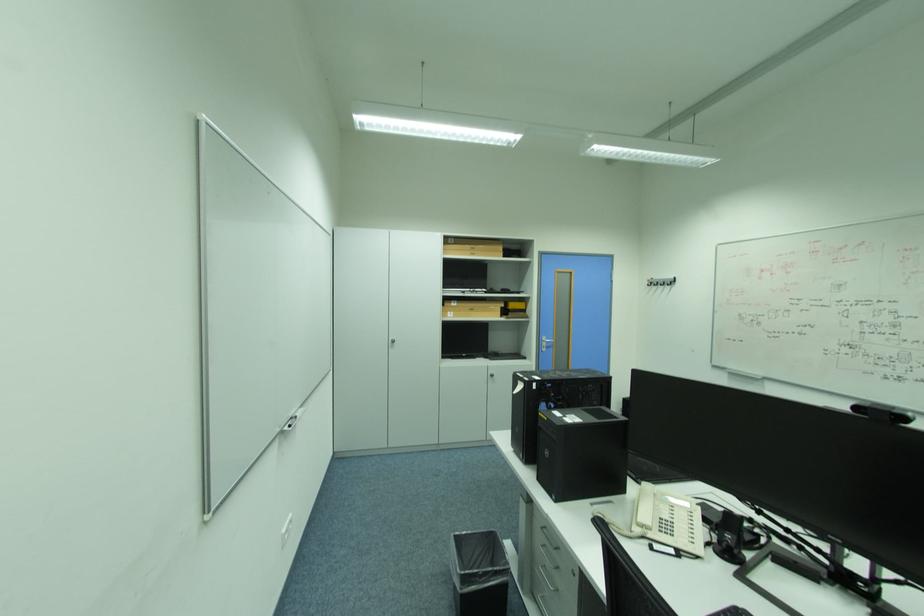
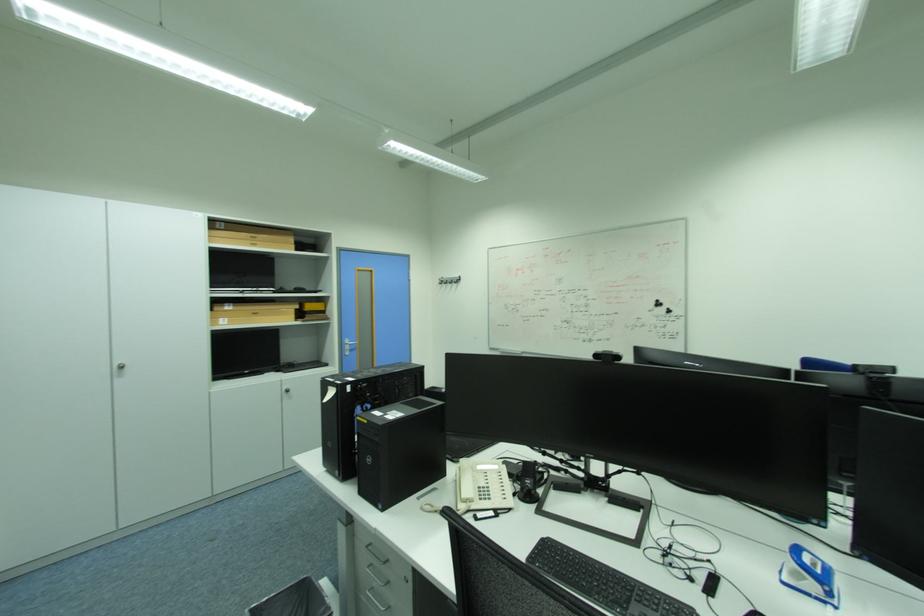
The point at [552,339] is marked in the first image. Where is the corresponding point in the second image?

(355, 342)